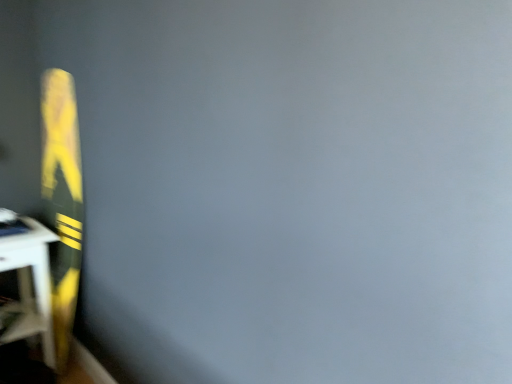
Question: Are matte black table at left and green matte board at left beside each other?

Choices:
 (A) no
 (B) yes

Answer: (A)

Question: Is matte black table at left to the right of green matte board at left from the viewer's perspective?

Choices:
 (A) no
 (B) yes

Answer: (A)

Question: Is matte black table at left located outside green matte board at left?

Choices:
 (A) yes
 (B) no

Answer: (A)

Question: From the image's perspective, is matte black table at left beneath green matte board at left?

Choices:
 (A) yes
 (B) no

Answer: (A)

Question: Does matte black table at left have a smaller size compared to green matte board at left?

Choices:
 (A) no
 (B) yes

Answer: (B)

Question: Can you confirm if matte black table at left is bigger than green matte board at left?

Choices:
 (A) no
 (B) yes

Answer: (A)

Question: Can you confirm if green matte board at left is thinner than matte black table at left?

Choices:
 (A) yes
 (B) no

Answer: (A)

Question: From a real-world perspective, is green matte board at left positioned under matte black table at left based on gravity?

Choices:
 (A) yes
 (B) no

Answer: (B)

Question: Is green matte board at left at the right side of matte black table at left?

Choices:
 (A) no
 (B) yes

Answer: (B)

Question: Is green matte board at left positioned far away from matte black table at left?

Choices:
 (A) yes
 (B) no

Answer: (B)

Question: Is matte black table at left at the back of green matte board at left?

Choices:
 (A) no
 (B) yes

Answer: (B)

Question: Considering the relative positions of green matte board at left and matte black table at left in the image provided, is green matte board at left in front of matte black table at left?

Choices:
 (A) yes
 (B) no

Answer: (A)

Question: Is green matte board at left wider or thinner than matte black table at left?

Choices:
 (A) wide
 (B) thin

Answer: (B)